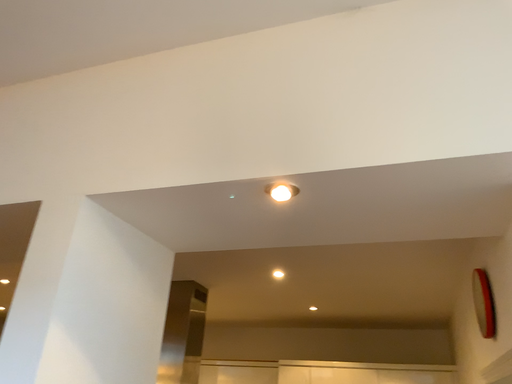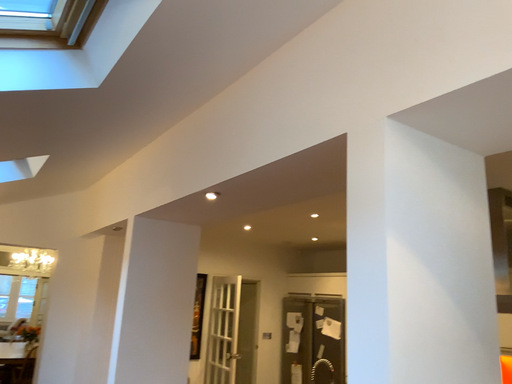
Question: How did the camera likely rotate when shooting the video?

Choices:
 (A) rotated right
 (B) rotated left

Answer: (B)